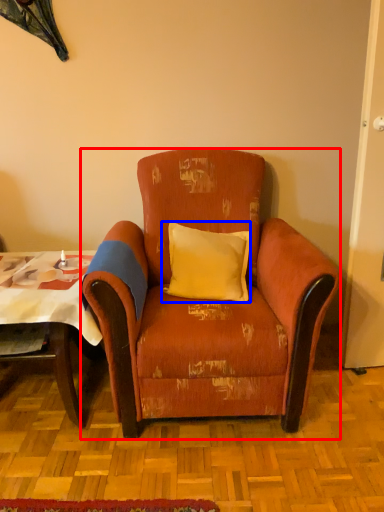
Question: Among these objects, which one is farthest to the camera, chair (highlighted by a red box) or pillow (highlighted by a blue box)?

Choices:
 (A) chair
 (B) pillow

Answer: (B)